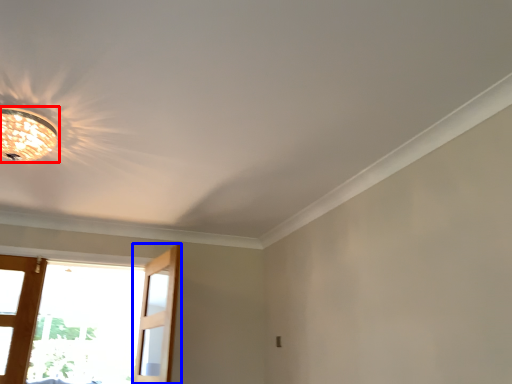
Question: Which of the following is the closest to the observer, lamp (highlighted by a red box) or screen door (highlighted by a blue box)?

Choices:
 (A) lamp
 (B) screen door

Answer: (A)